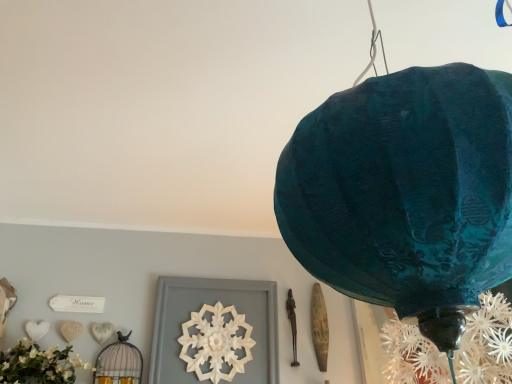
Question: Does point (118, 377) appear closer or farther from the camera than point (489, 76)?

Choices:
 (A) closer
 (B) farther

Answer: (B)

Question: Is matte black birdcage at lower left in front of or behind teal paper lantern at upper right in the image?

Choices:
 (A) front
 (B) behind

Answer: (B)

Question: Which of these objects is positioned farthest from the teal paper lantern at upper right?

Choices:
 (A) white carved wood at center
 (B) matte black birdcage at lower left

Answer: (B)

Question: Which object is the closest to the teal paper lantern at upper right?

Choices:
 (A) matte black birdcage at lower left
 (B) white carved wood at center

Answer: (B)